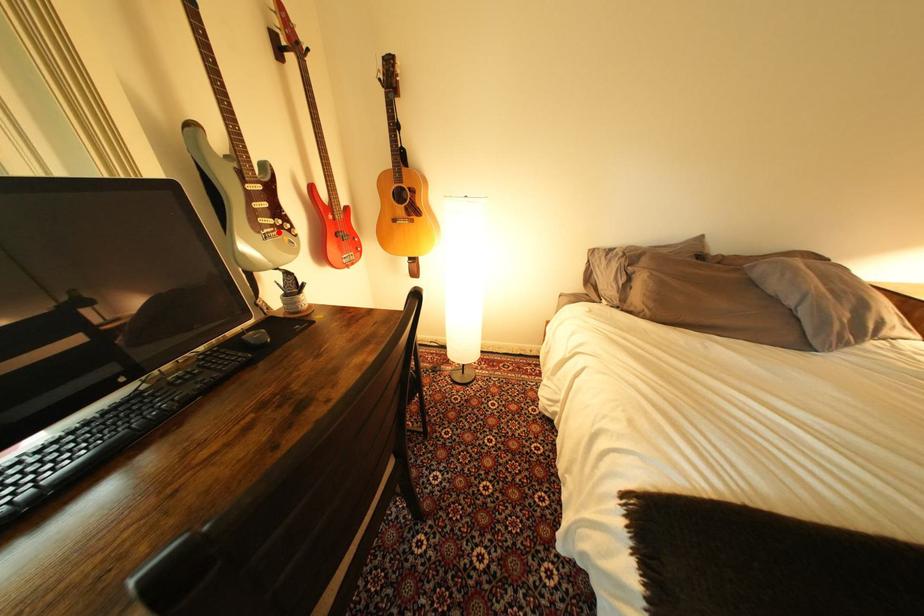
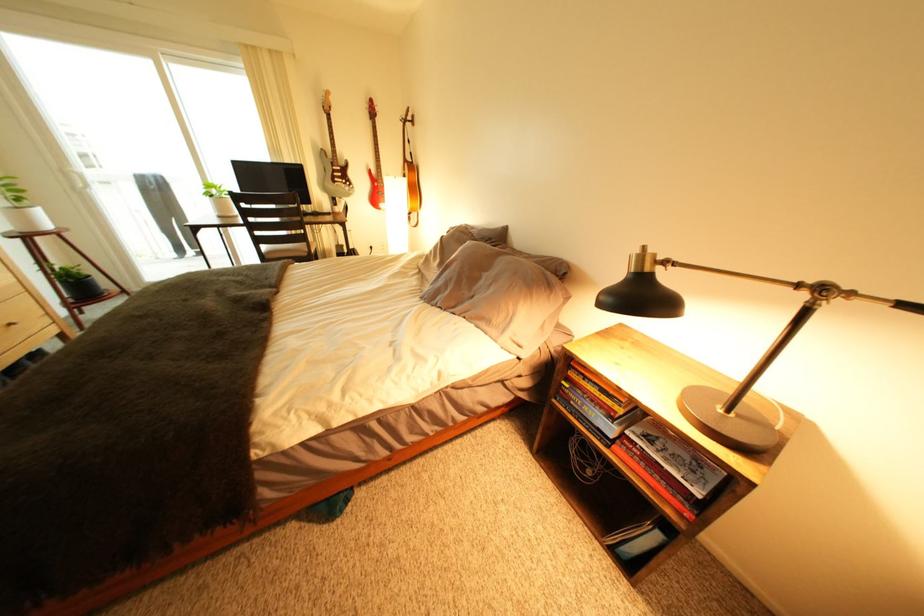
Locate, in the second image, the point that corresponds to the highlighted location in the first image.

(349, 185)